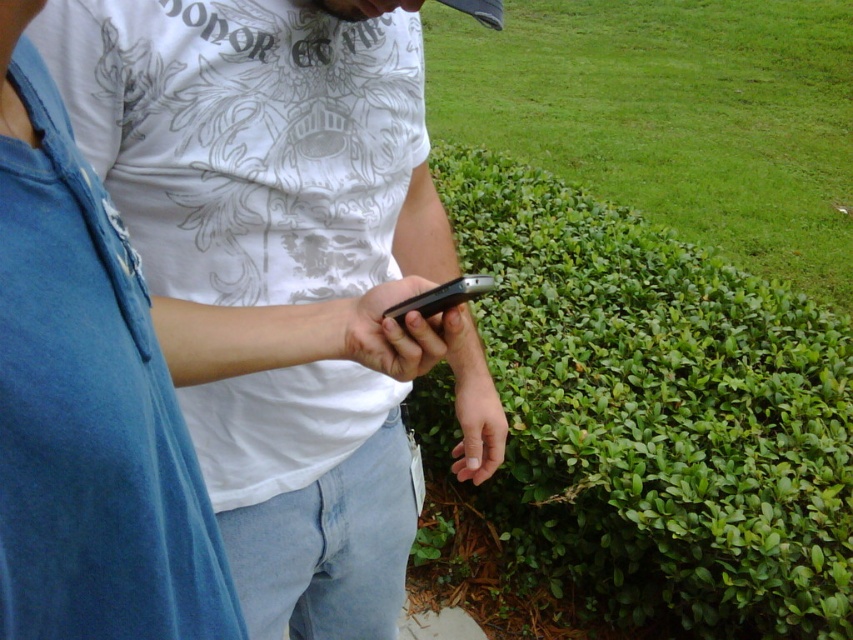
Question: Does green leafy bush at center appear under black matte smartphone at center?

Choices:
 (A) no
 (B) yes

Answer: (A)

Question: Is green leafy bush at center closer to the viewer compared to black matte smartphone at center?

Choices:
 (A) no
 (B) yes

Answer: (A)

Question: Is green leafy bush at center positioned behind black matte smartphone at center?

Choices:
 (A) no
 (B) yes

Answer: (B)

Question: Estimate the real-world distances between objects in this image. Which object is closer to the green leafy bush at center?

Choices:
 (A) matte white shirt at center
 (B) black matte smartphone at center

Answer: (A)

Question: Considering the real-world distances, which object is closest to the green leafy bush at center?

Choices:
 (A) black matte smartphone at center
 (B) matte white shirt at center

Answer: (B)

Question: Based on their relative distances, which object is nearer to the black matte smartphone at center?

Choices:
 (A) green leafy bush at center
 (B) matte white shirt at center

Answer: (B)